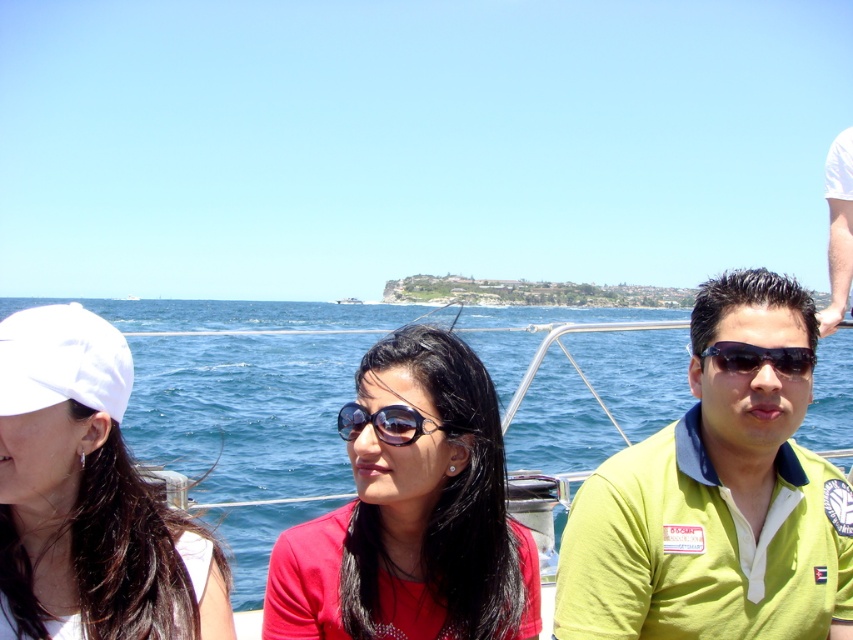
Between point (842, 308) and point (712, 356), which one is positioned in front?

Point (712, 356) is more forward.

Describe the element at coordinates (838, 228) in the screenshot. I see `white fabric arm at upper right` at that location.

Image resolution: width=853 pixels, height=640 pixels. Describe the element at coordinates (838, 228) in the screenshot. I see `white fabric arm at upper right` at that location.

I want to click on white fabric arm at upper right, so click(x=838, y=228).

Can you confirm if white fabric cap at left is bigger than white fabric arm at upper right?

No, white fabric cap at left is not bigger than white fabric arm at upper right.

Is white fabric cap at left wider than white fabric arm at upper right?

In fact, white fabric cap at left might be narrower than white fabric arm at upper right.

Which is behind, point (86, 467) or point (843, 188)?

Point (843, 188)

The height and width of the screenshot is (640, 853). In order to click on white fabric cap at left in this screenshot , I will do `click(86, 493)`.

Looking at this image, is matte black sunglasses at center thinner than white fabric cap at left?

Incorrect, matte black sunglasses at center's width is not less than white fabric cap at left's.

Looking at this image, is matte black sunglasses at center above white fabric cap at left?

Incorrect, matte black sunglasses at center is not positioned above white fabric cap at left.

Is point (457, 525) positioned after point (96, 406)?

That is True.

At what (x,y) coordinates should I click in order to perform the action: click on matte black sunglasses at center. Please return your answer as a coordinate pair (x, y). Looking at the image, I should click on (412, 513).